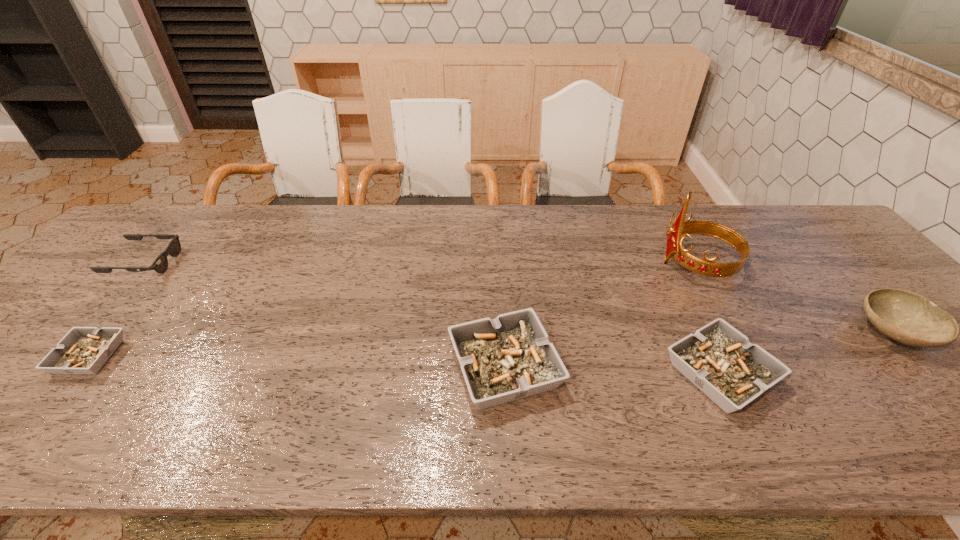
If equal spacing is the goal by inserting an additional ashtray among them, please point out a vacant space for this new ashtray. Please provide its 2D coordinates. Your answer should be formatted as a tuple, i.e. [(x, y)], where the tuple contains the x and y coordinates of a point satisfying the conditions above.

[(295, 362)]